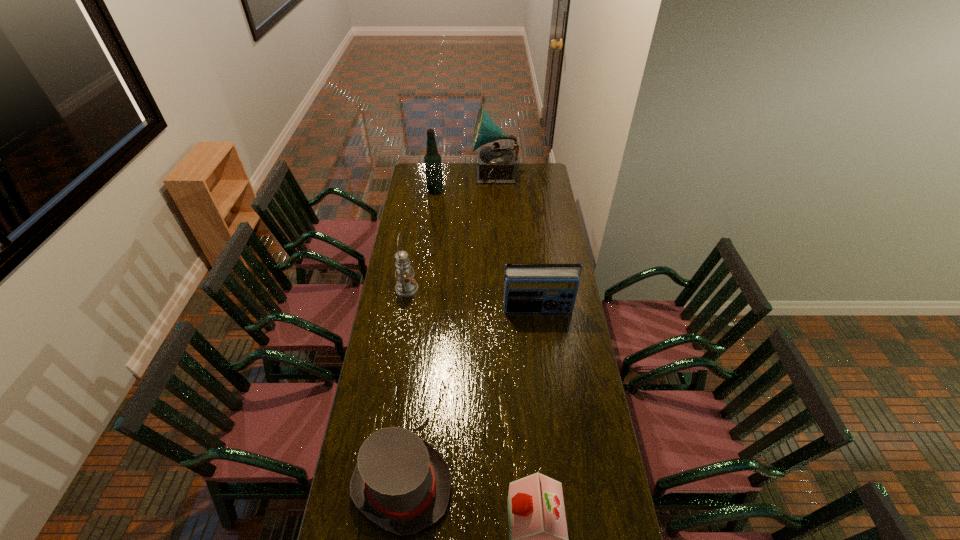
Locate an element on the screen. This screenshot has height=540, width=960. vacant space situated on the back of the fourth nearest object is located at coordinates (412, 259).

Find the location of a particular element. vacant region located 0.240m on the front panel of the fourth farthest object is located at coordinates (544, 360).

At what (x,y) coordinates should I click in order to perform the action: click on free space located 0.300m on the right of the shortest object. Please return your answer as a coordinate pair (x, y). The image size is (960, 540). Looking at the image, I should click on (540, 485).

Where is `object that is positioned at the far edge`? This screenshot has width=960, height=540. object that is positioned at the far edge is located at coordinates (496, 163).

The width and height of the screenshot is (960, 540). I want to click on alcohol that is at the left edge, so click(433, 165).

The height and width of the screenshot is (540, 960). Find the location of `oil lamp located at the left edge`. oil lamp located at the left edge is located at coordinates (406, 286).

Image resolution: width=960 pixels, height=540 pixels. In order to click on dress hat that is at the left edge in this screenshot , I will do `click(401, 483)`.

Image resolution: width=960 pixels, height=540 pixels. I want to click on object positioned at the right edge, so click(526, 290).

The height and width of the screenshot is (540, 960). Find the location of `vacant space at the left edge of the desktop`. vacant space at the left edge of the desktop is located at coordinates (411, 228).

At what (x,y) coordinates should I click in order to perform the action: click on free space at the right edge of the desktop. Please return your answer as a coordinate pair (x, y). Looking at the image, I should click on point(538,236).